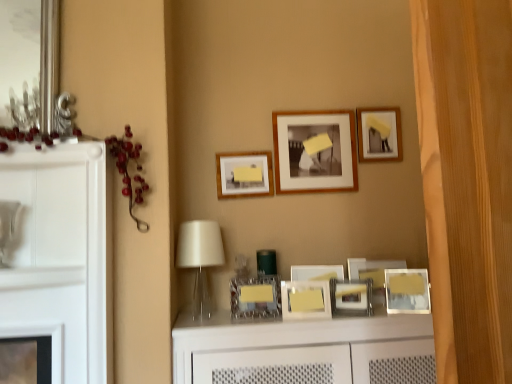
The image size is (512, 384). What are the coordinates of `metallic silver picture frame at center, acting as the sixth picture frame starting from the top` in the screenshot? It's located at (305, 300).

Where is `metallic silver picture frame at lower right, the fifth picture frame from the bottom`? Image resolution: width=512 pixels, height=384 pixels. metallic silver picture frame at lower right, the fifth picture frame from the bottom is located at coordinates (407, 291).

The height and width of the screenshot is (384, 512). What do you see at coordinates (200, 258) in the screenshot?
I see `translucent glass table lamp at center` at bounding box center [200, 258].

Describe the element at coordinates (372, 269) in the screenshot. I see `metallic silver picture frame at center, the 5th picture frame in the top-to-bottom sequence` at that location.

This screenshot has width=512, height=384. What are the coordinates of `matte wooden picture frame at upper center, the 3th picture frame viewed from the top` in the screenshot? It's located at (244, 174).

Identify the location of metallic silver picture frame at center, which is the 1th picture frame in bottom-to-top order. (351, 296).

Who is bigger, metallic silver picture frame at center, the 5th picture frame in the top-to-bottom sequence, or metallic silver picture frame at center, placed as the 7th picture frame when sorted from top to bottom?

Bigger between the two is metallic silver picture frame at center, the 5th picture frame in the top-to-bottom sequence.

Is metallic silver picture frame at center, the 4th picture frame from the bottom, oriented away from metallic silver picture frame at center, placed as the 7th picture frame when sorted from top to bottom?

No, metallic silver picture frame at center, placed as the 7th picture frame when sorted from top to bottom, is not at the back of metallic silver picture frame at center, the 4th picture frame from the bottom.

Is point (381, 286) closer to viewer compared to point (257, 293)?

No, it is not.

Consider the image. What's the angular difference between metallic silver picture frame at center, the 4th picture frame from the bottom, and metallic silver picture frame at center, placed as the 7th picture frame when sorted from top to bottom,'s facing directions?

There is a 17.1-degree angle between the facing directions of metallic silver picture frame at center, the 4th picture frame from the bottom, and metallic silver picture frame at center, placed as the 7th picture frame when sorted from top to bottom.

Is metallic silver picture frame at center, acting as the sixth picture frame starting from the top, wider or thinner than wooden picture frame at upper right, placed as the 8th picture frame when sorted from bottom to top?

metallic silver picture frame at center, acting as the sixth picture frame starting from the top, is thinner than wooden picture frame at upper right, placed as the 8th picture frame when sorted from bottom to top.

How distant is metallic silver picture frame at center, the 3th picture frame when ordered from bottom to top, from wooden picture frame at upper right, placed as the 8th picture frame when sorted from bottom to top?

metallic silver picture frame at center, the 3th picture frame when ordered from bottom to top, and wooden picture frame at upper right, placed as the 8th picture frame when sorted from bottom to top, are 29.22 inches apart from each other.

From the image's perspective, which one is positioned higher, metallic silver picture frame at center, the 3th picture frame when ordered from bottom to top, or wooden picture frame at upper right, acting as the first picture frame starting from the top?

From the image's view, wooden picture frame at upper right, acting as the first picture frame starting from the top, is above.

From a real-world perspective, is metallic silver picture frame at center, the 3th picture frame when ordered from bottom to top, above or below wooden picture frame at upper right, acting as the first picture frame starting from the top?

In terms of real-world spatial position, metallic silver picture frame at center, the 3th picture frame when ordered from bottom to top, is below wooden picture frame at upper right, acting as the first picture frame starting from the top.

Considering the sizes of objects wooden picture frame at upper right, acting as the first picture frame starting from the top, and metallic silver picture frame at center, which is the 1th picture frame in bottom-to-top order, in the image provided, who is taller, wooden picture frame at upper right, acting as the first picture frame starting from the top, or metallic silver picture frame at center, which is the 1th picture frame in bottom-to-top order,?

Standing taller between the two is wooden picture frame at upper right, acting as the first picture frame starting from the top.

Is wooden picture frame at upper right, placed as the 8th picture frame when sorted from bottom to top, positioned beyond the bounds of metallic silver picture frame at center, which is the 1th picture frame in bottom-to-top order?

Yes.

Can you confirm if wooden picture frame at upper right, acting as the first picture frame starting from the top, is bigger than metallic silver picture frame at center, the eighth picture frame from the top?

Indeed, wooden picture frame at upper right, acting as the first picture frame starting from the top, has a larger size compared to metallic silver picture frame at center, the eighth picture frame from the top.

Is point (369, 110) closer to viewer compared to point (367, 304)?

No, it is behind (367, 304).

Between metallic silver picture frame at center, the eighth picture frame from the top, and metallic silver picture frame at lower right, the 4th picture frame in the top-to-bottom sequence, which one appears on the left side from the viewer's perspective?

metallic silver picture frame at center, the eighth picture frame from the top.

Which object is more forward, metallic silver picture frame at center, which is the 1th picture frame in bottom-to-top order, or metallic silver picture frame at lower right, the fifth picture frame from the bottom?

metallic silver picture frame at center, which is the 1th picture frame in bottom-to-top order, is more forward.

From their relative heights in the image, would you say metallic silver picture frame at center, the eighth picture frame from the top, is taller or shorter than metallic silver picture frame at lower right, the 4th picture frame in the top-to-bottom sequence?

Considering their sizes, metallic silver picture frame at center, the eighth picture frame from the top, has less height than metallic silver picture frame at lower right, the 4th picture frame in the top-to-bottom sequence.

From a real-world perspective, between metallic silver picture frame at center, the eighth picture frame from the top, and metallic silver picture frame at lower right, the fifth picture frame from the bottom, who is vertically higher?

In real-world perspective, metallic silver picture frame at lower right, the fifth picture frame from the bottom, is above.

What's the angular difference between matte wooden picture frame at upper center, which is counted as the 6th picture frame, starting from the bottom, and wooden photo frame at center, which ranks as the 7th picture frame in bottom-to-top order,'s facing directions?

They differ by 1.27 degrees in their facing directions.

Based on the photo, choose the correct answer: Is matte wooden picture frame at upper center, the 3th picture frame viewed from the top, inside wooden photo frame at center, which is the second picture frame in top-to-bottom order, or outside it?

matte wooden picture frame at upper center, the 3th picture frame viewed from the top, exists outside the volume of wooden photo frame at center, which is the second picture frame in top-to-bottom order.

Could you tell me if matte wooden picture frame at upper center, the 3th picture frame viewed from the top, is facing wooden photo frame at center, which ranks as the 7th picture frame in bottom-to-top order?

No.

Is the depth of matte wooden picture frame at upper center, which is counted as the 6th picture frame, starting from the bottom, greater than that of wooden photo frame at center, which is the second picture frame in top-to-bottom order?

No, matte wooden picture frame at upper center, which is counted as the 6th picture frame, starting from the bottom, is in front of wooden photo frame at center, which is the second picture frame in top-to-bottom order.

From a real-world perspective, is metallic silver picture frame at center, the second picture frame ordered from the bottom, beneath matte wooden picture frame at upper center, which is counted as the 6th picture frame, starting from the bottom?

Correct, in the physical world, metallic silver picture frame at center, the second picture frame ordered from the bottom, is lower than matte wooden picture frame at upper center, which is counted as the 6th picture frame, starting from the bottom.

Is there a large distance between metallic silver picture frame at center, the second picture frame ordered from the bottom, and matte wooden picture frame at upper center, the 3th picture frame viewed from the top?

No, metallic silver picture frame at center, the second picture frame ordered from the bottom, is in close proximity to matte wooden picture frame at upper center, the 3th picture frame viewed from the top.

Can you confirm if metallic silver picture frame at center, the second picture frame ordered from the bottom, is bigger than matte wooden picture frame at upper center, the 3th picture frame viewed from the top?

Correct, metallic silver picture frame at center, the second picture frame ordered from the bottom, is larger in size than matte wooden picture frame at upper center, the 3th picture frame viewed from the top.

Is matte wooden picture frame at upper center, the 3th picture frame viewed from the top, completely or partially inside metallic silver picture frame at center, the second picture frame ordered from the bottom?

No, matte wooden picture frame at upper center, the 3th picture frame viewed from the top, is not inside metallic silver picture frame at center, the second picture frame ordered from the bottom.

Could you tell me if white glossy vanity at center is facing metallic silver picture frame at center, the 3th picture frame when ordered from bottom to top?

No, white glossy vanity at center is not aimed at metallic silver picture frame at center, the 3th picture frame when ordered from bottom to top.

Who is taller, white glossy vanity at center or metallic silver picture frame at center, acting as the sixth picture frame starting from the top?

white glossy vanity at center is taller.

Considering the relative sizes of white glossy vanity at center and metallic silver picture frame at center, the 3th picture frame when ordered from bottom to top, in the image provided, is white glossy vanity at center wider than metallic silver picture frame at center, the 3th picture frame when ordered from bottom to top,?

Indeed, white glossy vanity at center has a greater width compared to metallic silver picture frame at center, the 3th picture frame when ordered from bottom to top.

Who is bigger, white glossy vanity at center or metallic silver picture frame at center, the 3th picture frame when ordered from bottom to top?

white glossy vanity at center.

The image size is (512, 384). What are the coordinates of `picture frame that is the 2nd one when counting forward from the metallic silver picture frame at center, the 5th picture frame in the top-to-bottom sequence` in the screenshot? It's located at (255, 296).

You are a GUI agent. You are given a task and a screenshot of the screen. Output one action in this format:
    pyautogui.click(x=<x>, y=<y>)
    Task: Click on the 4th picture frame to the left of the wooden picture frame at upper right, placed as the 8th picture frame when sorted from bottom to top, counting from the anchor's position
    The height and width of the screenshot is (384, 512).
    Given the screenshot: What is the action you would take?
    pyautogui.click(x=305, y=300)

Which object lies nearer to the anchor point metallic silver picture frame at center, the 5th picture frame in the top-to-bottom sequence, wooden photo frame at center, which ranks as the 7th picture frame in bottom-to-top order, or translucent glass table lamp at center?

wooden photo frame at center, which ranks as the 7th picture frame in bottom-to-top order, lies closer to metallic silver picture frame at center, the 5th picture frame in the top-to-bottom sequence, than the other object.

Looking at this image, which object lies further to the anchor point metallic silver picture frame at center, placed as the 7th picture frame when sorted from top to bottom, translucent glass table lamp at center or metallic silver picture frame at center, the eighth picture frame from the top?

Among the two, metallic silver picture frame at center, the eighth picture frame from the top, is located further to metallic silver picture frame at center, placed as the 7th picture frame when sorted from top to bottom.

Considering their positions, is metallic silver picture frame at lower right, the 4th picture frame in the top-to-bottom sequence, positioned further to metallic silver picture frame at center, the 4th picture frame from the bottom, than white glossy vanity at center?

white glossy vanity at center lies further to metallic silver picture frame at center, the 4th picture frame from the bottom, than the other object.

From the image, which object appears to be farther from matte wooden picture frame at upper center, the 3th picture frame viewed from the top, wooden picture frame at upper right, acting as the first picture frame starting from the top, or metallic silver picture frame at center, acting as the sixth picture frame starting from the top?

Among the two, wooden picture frame at upper right, acting as the first picture frame starting from the top, is located further to matte wooden picture frame at upper center, the 3th picture frame viewed from the top.

Considering their positions, is metallic silver picture frame at center, the 5th picture frame in the top-to-bottom sequence, positioned closer to wooden picture frame at upper right, acting as the first picture frame starting from the top, than metallic silver picture frame at center, the 3th picture frame when ordered from bottom to top?

Based on the image, metallic silver picture frame at center, the 5th picture frame in the top-to-bottom sequence, appears to be nearer to wooden picture frame at upper right, acting as the first picture frame starting from the top.

Considering their positions, is matte wooden picture frame at upper center, the 3th picture frame viewed from the top, positioned closer to metallic silver picture frame at center, the 4th picture frame from the bottom, than metallic silver picture frame at center, the 3th picture frame when ordered from bottom to top?

The object closer to metallic silver picture frame at center, the 4th picture frame from the bottom, is metallic silver picture frame at center, the 3th picture frame when ordered from bottom to top.

Estimate the real-world distances between objects in this image. Which object is further from translucent glass table lamp at center, metallic silver picture frame at center, acting as the sixth picture frame starting from the top, or wooden photo frame at center, which is the second picture frame in top-to-bottom order?

wooden photo frame at center, which is the second picture frame in top-to-bottom order.

Looking at the image, which one is located closer to wooden photo frame at center, which is the second picture frame in top-to-bottom order, metallic silver picture frame at center, placed as the 7th picture frame when sorted from top to bottom, or metallic silver picture frame at center, which is the 1th picture frame in bottom-to-top order?

Based on the image, metallic silver picture frame at center, which is the 1th picture frame in bottom-to-top order, appears to be nearer to wooden photo frame at center, which is the second picture frame in top-to-bottom order.

The image size is (512, 384). What are the coordinates of `vanity located between metallic silver picture frame at center, acting as the sixth picture frame starting from the top, and metallic silver picture frame at lower right, the fifth picture frame from the bottom, in the left-right direction` in the screenshot? It's located at (305, 350).

The width and height of the screenshot is (512, 384). Find the location of `table lamp between matte wooden picture frame at upper center, the 3th picture frame viewed from the top, and metallic silver picture frame at center, placed as the 7th picture frame when sorted from top to bottom, from top to bottom`. table lamp between matte wooden picture frame at upper center, the 3th picture frame viewed from the top, and metallic silver picture frame at center, placed as the 7th picture frame when sorted from top to bottom, from top to bottom is located at coordinates tap(200, 258).

The width and height of the screenshot is (512, 384). I want to click on picture frame between wooden photo frame at center, which is the second picture frame in top-to-bottom order, and translucent glass table lamp at center, in the vertical direction, so click(x=244, y=174).

Find the location of `vanity between metallic silver picture frame at center, the second picture frame ordered from the bottom, and metallic silver picture frame at lower right, the 4th picture frame in the top-to-bottom sequence, from left to right`. vanity between metallic silver picture frame at center, the second picture frame ordered from the bottom, and metallic silver picture frame at lower right, the 4th picture frame in the top-to-bottom sequence, from left to right is located at coordinates pos(305,350).